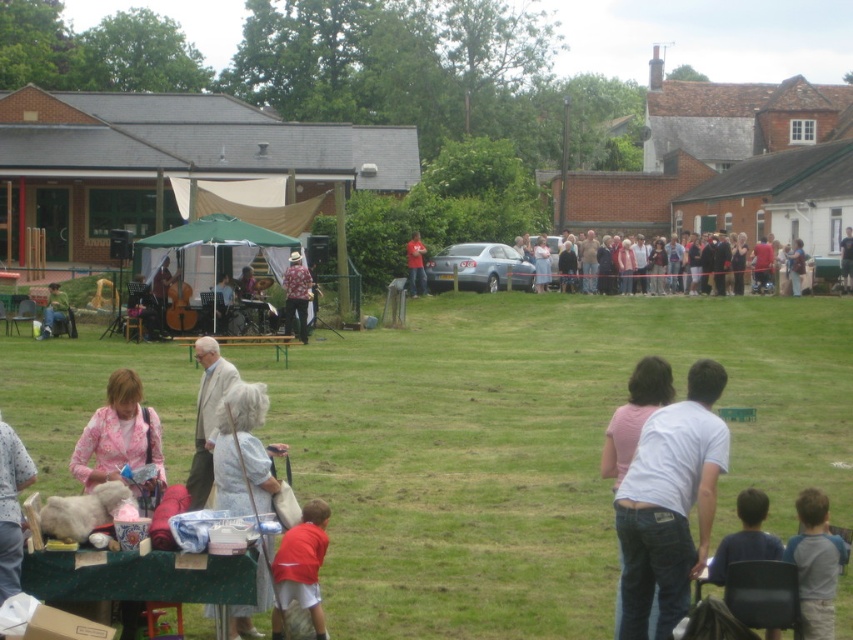
You are organizing a photo shoot and need to place a large prop next to the matte pink jacket at lower left and the dark blue shirt at lower right. Which of the two should you place the prop next to if you want it to look proportionally smaller in the photo?

You should place the large prop next to the matte pink jacket at lower left because it is larger in size compared to the dark blue shirt at lower right, making the prop appear proportionally smaller when placed next to the larger jacket.

Looking at this image, you are standing at the edge of the grassy field where the community event is happening. You see a point marked at coordinates (782, 280). What object is located at that point?

The matte black jacket at center is located at point (782, 280).

You are standing at the edge of the grassy field and want to approach the musicians on the stage. You see the matte pink jacket at lower left and the dark blue shirt at lower right. Which one is closer to you?

The matte pink jacket at lower left is closer to you because it is further to the viewer than the dark blue shirt at lower right.